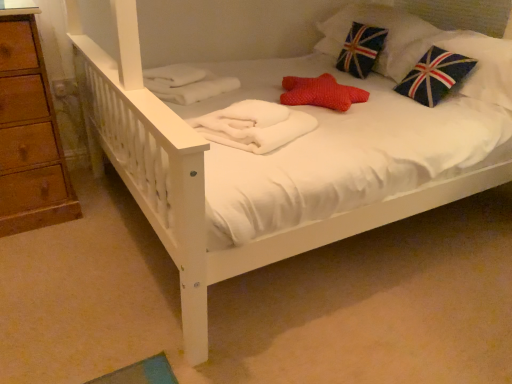
What do you see at coordinates (254, 126) in the screenshot? The width and height of the screenshot is (512, 384). I see `white fluffy blanket at center` at bounding box center [254, 126].

Image resolution: width=512 pixels, height=384 pixels. Identify the location of white fluffy blanket at center. (254, 126).

Locate an element on the screen. The image size is (512, 384). velvet union jack pillow at upper right is located at coordinates (386, 38).

This screenshot has height=384, width=512. What do you see at coordinates (386, 38) in the screenshot? I see `velvet union jack pillow at upper right` at bounding box center [386, 38].

Identify the location of white fluffy blanket at center. tap(254, 126).

Which is more to the right, white fluffy blanket at center or velvet union jack pillow at upper right?

velvet union jack pillow at upper right.

Between white fluffy blanket at center and velvet union jack pillow at upper right, which one is positioned behind?

velvet union jack pillow at upper right is more distant.

Does point (224, 116) lie in front of point (334, 55)?

Yes.

From the image's perspective, does white fluffy blanket at center appear lower than velvet union jack pillow at upper right?

Indeed, from the image's perspective, white fluffy blanket at center is shown beneath velvet union jack pillow at upper right.

From a real-world perspective, between white fluffy blanket at center and velvet union jack pillow at upper right, who is vertically higher?

From a 3D spatial view, velvet union jack pillow at upper right is above.

Is white fluffy blanket at center wider than velvet union jack pillow at upper right?

No.

Considering the relative sizes of white fluffy blanket at center and velvet union jack pillow at upper right in the image provided, is white fluffy blanket at center shorter than velvet union jack pillow at upper right?

Yes.

In the scene shown: Based on their sizes in the image, would you say white fluffy blanket at center is bigger or smaller than velvet union jack pillow at upper right?

In the image, white fluffy blanket at center appears to be smaller than velvet union jack pillow at upper right.

Is velvet union jack pillow at upper right a part of white fluffy blanket at center?

No, velvet union jack pillow at upper right is not a part of white fluffy blanket at center.

Is white fluffy blanket at center next to velvet union jack pillow at upper right and touching it?

No.

Could you tell me if white fluffy blanket at center is facing velvet union jack pillow at upper right?

No, white fluffy blanket at center is not facing towards velvet union jack pillow at upper right.

How many degrees apart are the facing directions of white fluffy blanket at center and velvet union jack pillow at upper right?

There is a 24.5-degree angle between the facing directions of white fluffy blanket at center and velvet union jack pillow at upper right.

Identify the location of pillow above the white fluffy blanket at center (from the image's perspective). The width and height of the screenshot is (512, 384). (386, 38).

Can you confirm if velvet union jack pillow at upper right is positioned to the left of white fluffy blanket at center?

In fact, velvet union jack pillow at upper right is to the right of white fluffy blanket at center.

Considering the positions of objects velvet union jack pillow at upper right and white fluffy blanket at center in the image provided, who is behind, velvet union jack pillow at upper right or white fluffy blanket at center?

velvet union jack pillow at upper right is further away from the camera.

Considering the points (389, 57) and (207, 138), which point is in front, point (389, 57) or point (207, 138)?

Point (207, 138)

From the image's perspective, relative to white fluffy blanket at center, is velvet union jack pillow at upper right above or below?

velvet union jack pillow at upper right is above white fluffy blanket at center.

From a real-world perspective, does velvet union jack pillow at upper right stand above white fluffy blanket at center?

Yes, from a real-world perspective, velvet union jack pillow at upper right is above white fluffy blanket at center.

Does velvet union jack pillow at upper right have a greater width compared to white fluffy blanket at center?

Yes.

Is velvet union jack pillow at upper right taller than white fluffy blanket at center?

Yes.

Who is smaller, velvet union jack pillow at upper right or white fluffy blanket at center?

Smaller between the two is white fluffy blanket at center.

Is velvet union jack pillow at upper right not within white fluffy blanket at center?

Yes, velvet union jack pillow at upper right is not within white fluffy blanket at center.

Is velvet union jack pillow at upper right far from white fluffy blanket at center?

Absolutely, velvet union jack pillow at upper right is distant from white fluffy blanket at center.

Is velvet union jack pillow at upper right turned away from white fluffy blanket at center?

That's not correct — velvet union jack pillow at upper right is not looking away from white fluffy blanket at center.

How far apart are velvet union jack pillow at upper right and white fluffy blanket at center?

velvet union jack pillow at upper right is 3.50 feet away from white fluffy blanket at center.

The width and height of the screenshot is (512, 384). I want to click on pillow on the right side of white fluffy blanket at center, so click(x=386, y=38).

Where is `material below the velvet union jack pillow at upper right (from a real-world perspective)`? material below the velvet union jack pillow at upper right (from a real-world perspective) is located at coordinates (254, 126).

You are a GUI agent. You are given a task and a screenshot of the screen. Output one action in this format:
    pyautogui.click(x=<x>, y=<y>)
    Task: Click on the pillow that appears above the white fluffy blanket at center (from the image's perspective)
    The height and width of the screenshot is (384, 512).
    Given the screenshot: What is the action you would take?
    pyautogui.click(x=386, y=38)